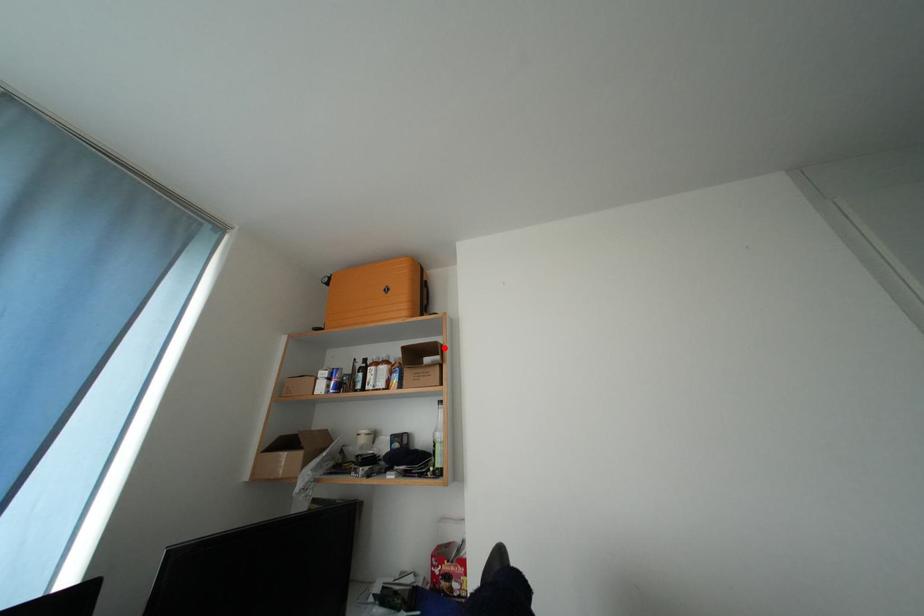
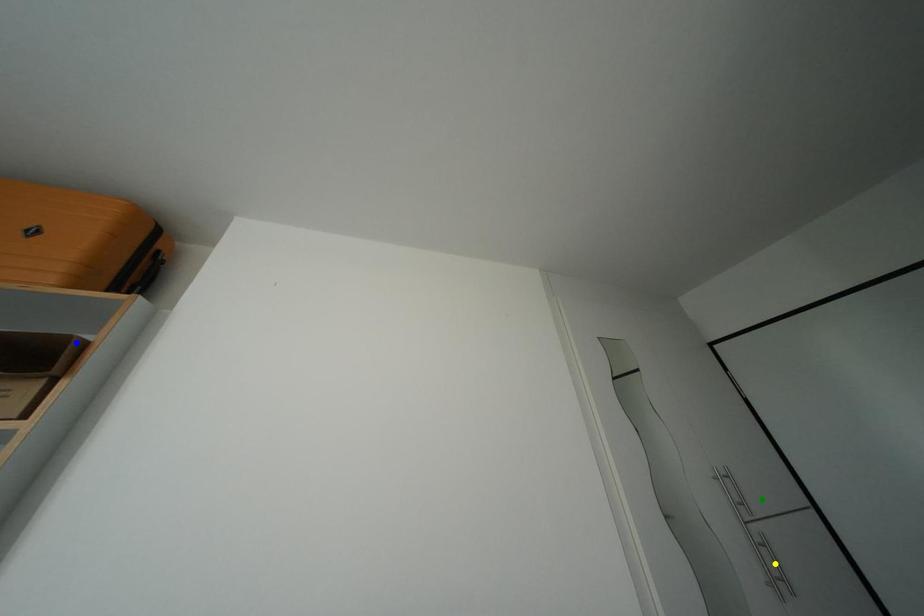
Question: I am providing you with two images of the same scene from different viewpoints. A red point is marked on the first image. You are given multiple points on the second image. Which point in image 2 is actually the same real-world point as the red point in image 1?

Choices:
 (A) green point
 (B) blue point
 (C) yellow point

Answer: (B)